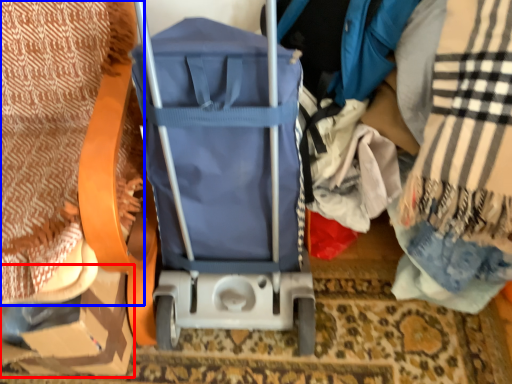
Question: Which object appears farthest to the camera in this image, cardboard box (highlighted by a red box) or blanket (highlighted by a blue box)?

Choices:
 (A) cardboard box
 (B) blanket

Answer: (A)